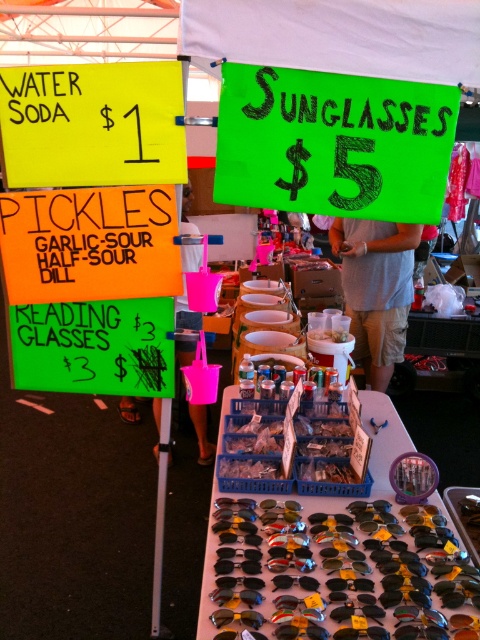
Between shiny plastic sunglasses at center and shiny black sunglasses at center, which one is positioned higher?

shiny plastic sunglasses at center

Who is shorter, shiny plastic sunglasses at center or shiny black sunglasses at center?

With less height is shiny black sunglasses at center.

Which is in front, point (406, 436) or point (350, 634)?

Point (350, 634) is in front.

Identify the location of shiny plastic sunglasses at center. This screenshot has width=480, height=640. (333, 541).

Can you confirm if sour garlic pickles at center is positioned to the left of black plastic sunglasses at center?

In fact, sour garlic pickles at center is to the right of black plastic sunglasses at center.

Who is shorter, sour garlic pickles at center or black plastic sunglasses at center?

black plastic sunglasses at center is shorter.

Is point (367, 490) closer to viewer compared to point (299, 584)?

No, (367, 490) is further to viewer.

The width and height of the screenshot is (480, 640). In order to click on sour garlic pickles at center in this screenshot , I will do `click(298, 444)`.

Is point (215, 493) farther from viewer compared to point (370, 584)?

Yes, point (215, 493) is farther from viewer.

Locate an element on the screen. shiny plastic sunglasses at center is located at coordinates (333, 541).

I want to click on shiny plastic sunglasses at center, so click(x=333, y=541).